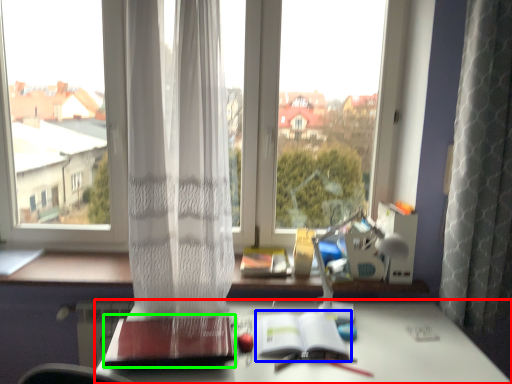
Question: Considering the real-world distances, which object is farthest from desk (highlighted by a red box)? paperback book (highlighted by a blue box) or paperback book (highlighted by a green box)?

Choices:
 (A) paperback book
 (B) paperback book

Answer: (B)